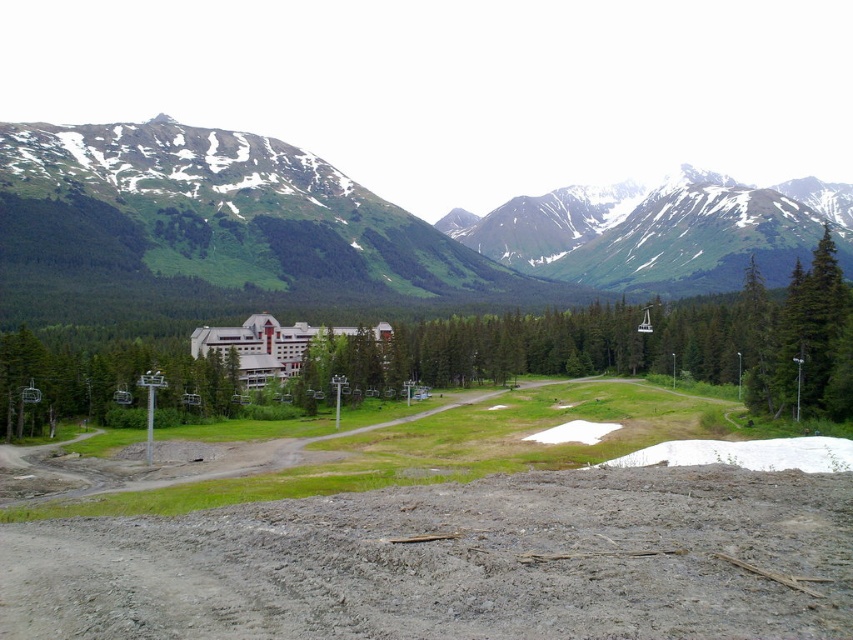
You are planning to build a small cabin on the green grassy mountain at center and the green matte tree at center. Which location would be higher in elevation?

The green grassy mountain at center is positioned over the green matte tree at center, so building the cabin on the green grassy mountain at center would be higher in elevation.

You are planning to hike towards the building complex in the distance. You see the brown sandy dirt track at lower center and the green matte tree at center. Which object is closer to you as you start your hike?

The brown sandy dirt track at lower center is closer to you because it is in front of the green matte tree at center.

You are standing at the camera position and want to reach the point marked at coordinates point (245, 200). Given that you can walk 1000 feet per hour, how long will it take you to reach that point assuming a straight path?

The distance between the camera and point (245, 200) is 998.06 feet. Since you walk 1000 feet per hour, it will take approximately 59.88 minutes to reach the point.